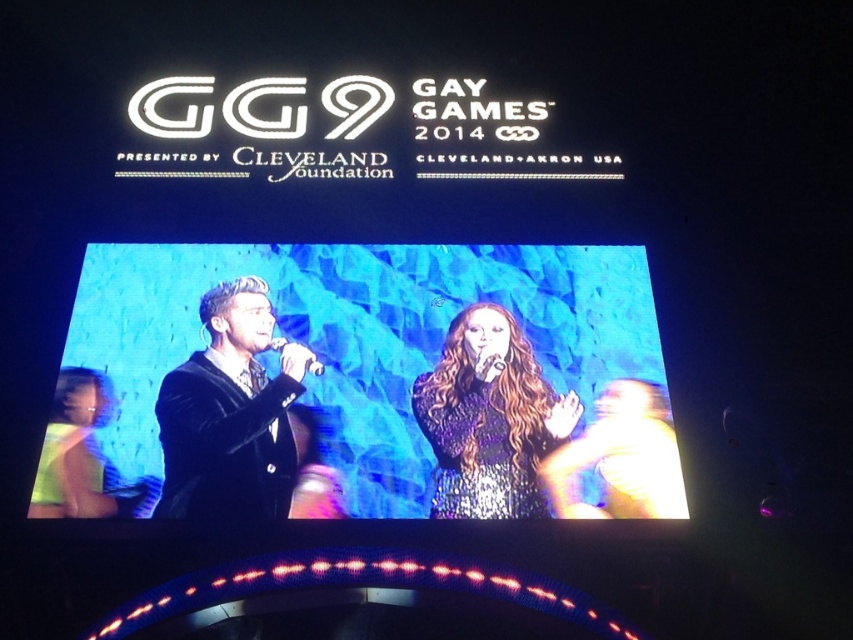
You are at the live event and want to take a photo of both the black velvet suit at center and the shiny sequined dress at center. Which one should you focus on first if you want to capture them in order from top to bottom?

Result: The black velvet suit at center is above the shiny sequined dress at center, so you should focus on the black velvet suit at center first from top to bottom.